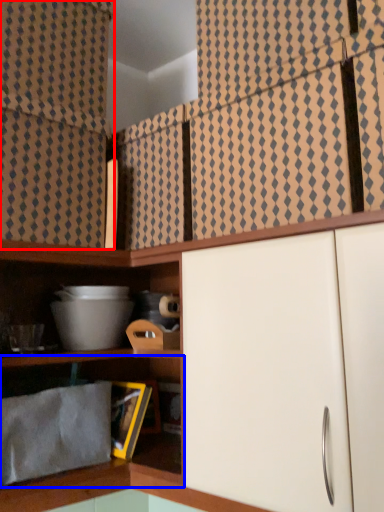
Question: Which object is closer to the camera taking this photo, curtain (highlighted by a red box) or shelf (highlighted by a blue box)?

Choices:
 (A) curtain
 (B) shelf

Answer: (B)